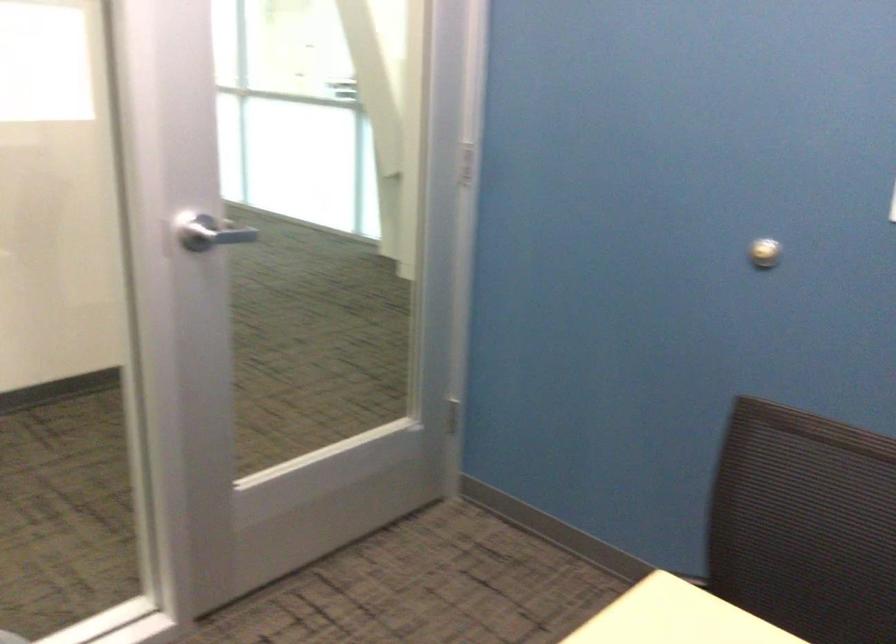
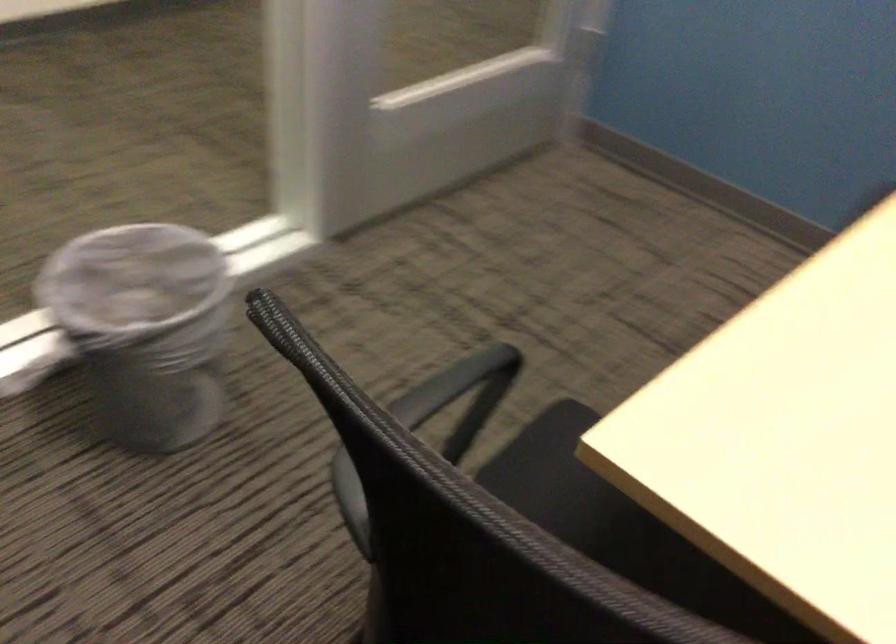
Question: Based on the continuous images, in which direction is the camera rotating? Reply with the corresponding letter.

Choices:
 (A) Left
 (B) Right
 (C) Up
 (D) Down

Answer: (D)